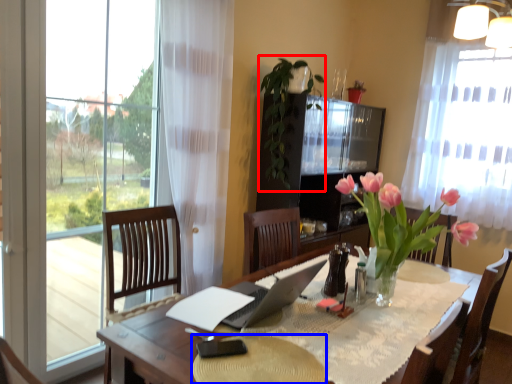
Question: Which object appears closest to the camera in this image, plant (highlighted by a red box) or flat (highlighted by a blue box)?

Choices:
 (A) plant
 (B) flat

Answer: (B)